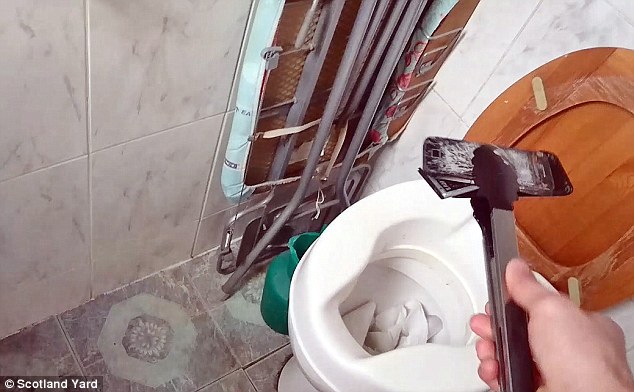
Where is `wall`? wall is located at coordinates (120, 110), (512, 49).